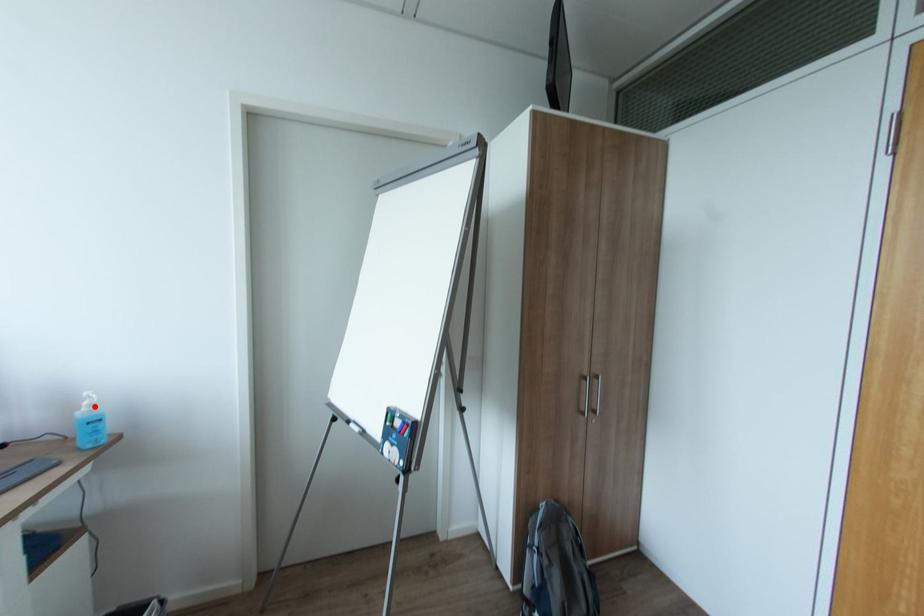
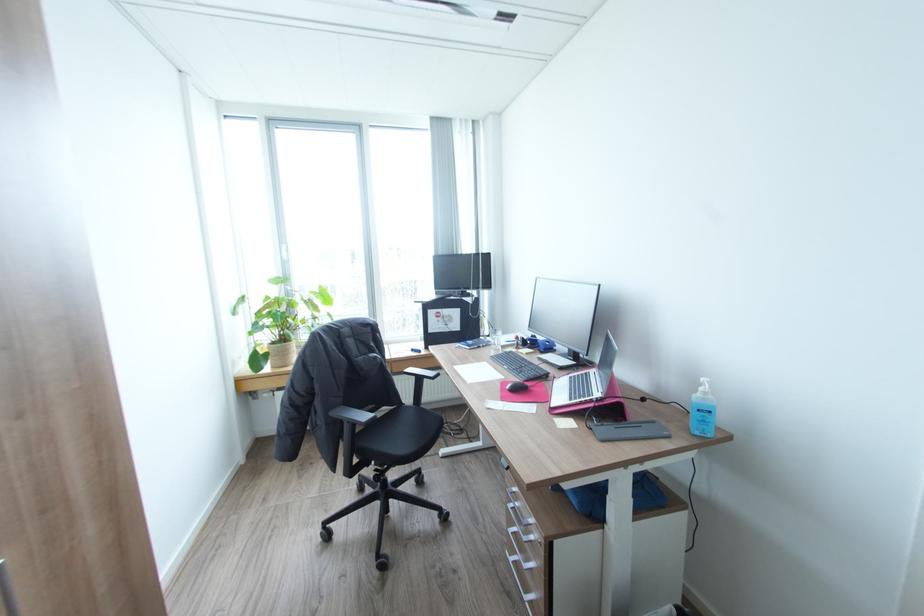
Locate, in the second image, the point that corresponds to the highlighted location in the first image.

(710, 392)